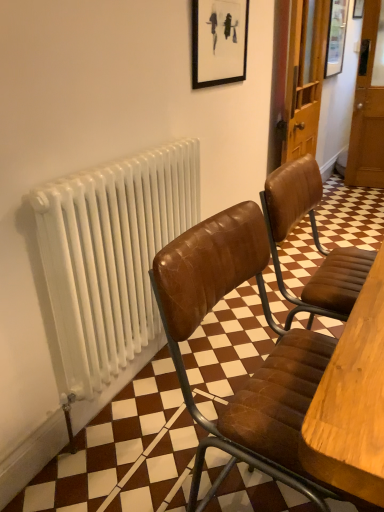
Question: Based on their positions, is wooden picture frame at upper right located to the left or right of white metallic radiator at left?

Choices:
 (A) left
 (B) right

Answer: (B)

Question: Choose the correct answer: Is wooden picture frame at upper right inside white metallic radiator at left or outside it?

Choices:
 (A) inside
 (B) outside

Answer: (B)

Question: From the image's perspective, is wooden picture frame at upper right above or below white metallic radiator at left?

Choices:
 (A) below
 (B) above

Answer: (B)

Question: Would you say white metallic radiator at left is to the left or to the right of wooden picture frame at upper right in the picture?

Choices:
 (A) right
 (B) left

Answer: (B)

Question: Is white metallic radiator at left wider or thinner than wooden picture frame at upper right?

Choices:
 (A) thin
 (B) wide

Answer: (A)

Question: Is white metallic radiator at left spatially inside wooden picture frame at upper right, or outside of it?

Choices:
 (A) outside
 (B) inside

Answer: (A)

Question: From their relative heights in the image, would you say white metallic radiator at left is taller or shorter than wooden picture frame at upper right?

Choices:
 (A) short
 (B) tall

Answer: (A)